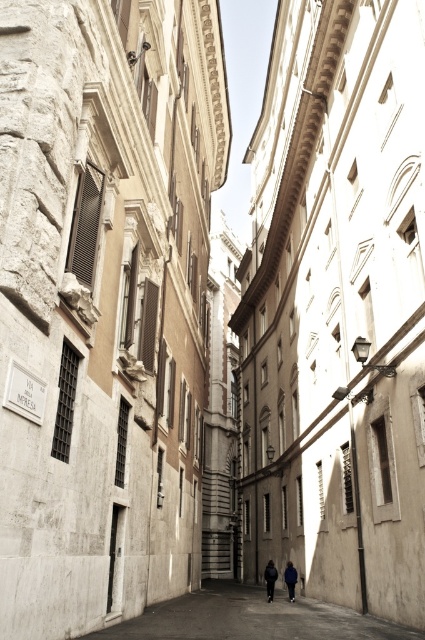
You are a delivery person carrying a large package and need to navigate through the narrow street. You see the concrete alley at center and the blue fabric jacket at center. Which path should you choose to ensure your package can pass through safely?

The concrete alley at center has a larger size compared to the blue fabric jacket at center, so you should choose the concrete alley at center to ensure your large package can pass through safely.

You are a delivery person with a 1.5 meter wide cart. You need to navigate through the narrow street shown in the image. Can your cart fit through the concrete alley at center without touching the blue fabric jacket at center?

The concrete alley at center might be wider than blue fabric jacket at center, so there is a possibility that the cart can pass through. However, since the exact width difference isn not specified, it is recommended to proceed with caution to avoid collision.